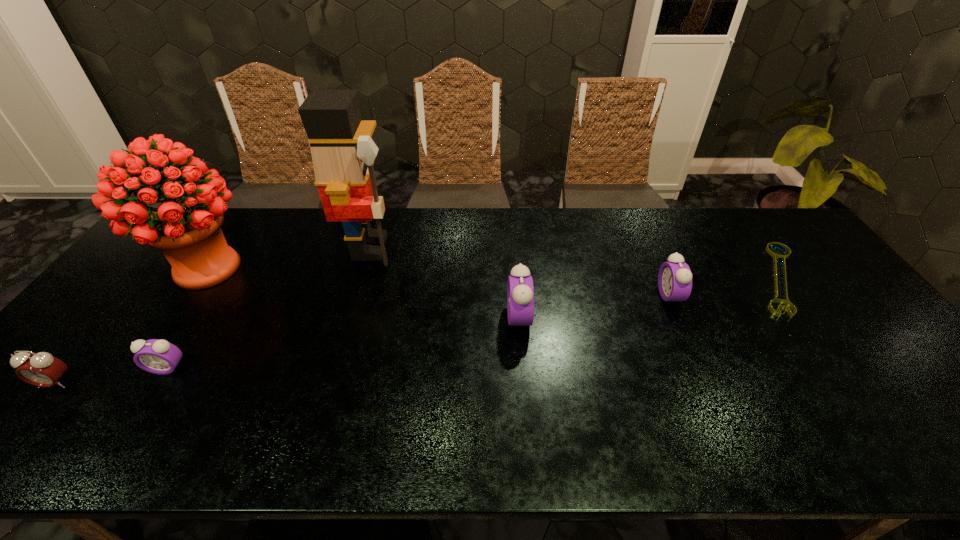
This screenshot has width=960, height=540. What are the coordinates of `free space between the bouquet and the rightmost object` in the screenshot? It's located at click(492, 273).

Locate an element on the screen. The height and width of the screenshot is (540, 960). free spot between the rightmost alarm clock and the second nearest object is located at coordinates (418, 332).

What are the coordinates of `vacant area between the nearest alarm clock and the fourth object from left to right` in the screenshot? It's located at (213, 315).

Locate an element on the screen. This screenshot has height=540, width=960. free space between the bouquet and the nutcracker is located at coordinates (288, 258).

Identify the location of free space between the fourth object from left to right and the rightmost object. This screenshot has height=540, width=960. (574, 263).

I want to click on free space between the bouquet and the second shortest object, so click(186, 318).

Where is `unoccupied area between the third object from right to left and the shortest object`? This screenshot has width=960, height=540. unoccupied area between the third object from right to left and the shortest object is located at coordinates (649, 298).

Point out which object is positioned as the second nearest to the sixth object from left to right. Please provide its 2D coordinates. Your answer should be formatted as a tuple, i.e. [(x, y)], where the tuple contains the x and y coordinates of a point satisfying the conditions above.

[(520, 291)]

Select which object appears as the fifth closest to the third alarm clock from left to right. Please provide its 2D coordinates. Your answer should be formatted as a tuple, i.e. [(x, y)], where the tuple contains the x and y coordinates of a point satisfying the conditions above.

[(156, 356)]

Locate which alarm clock is the second closest to the bouquet. Please provide its 2D coordinates. Your answer should be formatted as a tuple, i.e. [(x, y)], where the tuple contains the x and y coordinates of a point satisfying the conditions above.

[(41, 369)]